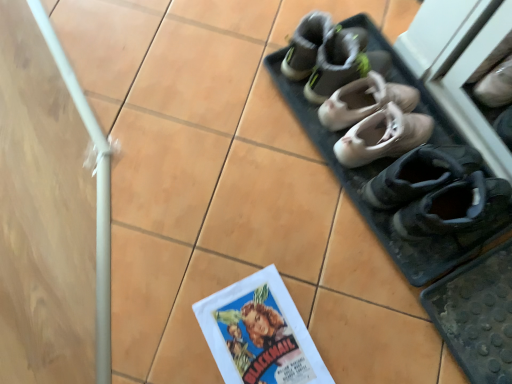
Question: Could you tell me if matte paper comic book at lower center is facing gray suede sneakers at upper center, which is the fifth footwear in bottom-to-top order?

Choices:
 (A) yes
 (B) no

Answer: (B)

Question: From the image's perspective, does matte paper comic book at lower center appear lower than gray suede sneakers at upper center, arranged as the 1th footwear when viewed from the top?

Choices:
 (A) yes
 (B) no

Answer: (A)

Question: Is matte paper comic book at lower center wider than gray suede sneakers at upper center, arranged as the 1th footwear when viewed from the top?

Choices:
 (A) yes
 (B) no

Answer: (A)

Question: Can you confirm if matte paper comic book at lower center is smaller than gray suede sneakers at upper center, arranged as the 1th footwear when viewed from the top?

Choices:
 (A) no
 (B) yes

Answer: (B)

Question: From a real-world perspective, is matte paper comic book at lower center beneath gray suede sneakers at upper center, arranged as the 1th footwear when viewed from the top?

Choices:
 (A) no
 (B) yes

Answer: (B)

Question: Considering the positions of gray suede sneakers at upper center, which is the fifth footwear in bottom-to-top order, and black suede shoes at lower right, positioned as the 1th footwear in bottom-to-top order, in the image, is gray suede sneakers at upper center, which is the fifth footwear in bottom-to-top order, taller or shorter than black suede shoes at lower right, positioned as the 1th footwear in bottom-to-top order,?

Choices:
 (A) short
 (B) tall

Answer: (A)

Question: In terms of size, does gray suede sneakers at upper center, which is the fifth footwear in bottom-to-top order, appear bigger or smaller than black suede shoes at lower right, positioned as the 1th footwear in bottom-to-top order?

Choices:
 (A) big
 (B) small

Answer: (B)

Question: Is gray suede sneakers at upper center, which is the fifth footwear in bottom-to-top order, situated inside black suede shoes at lower right, positioned as the 1th footwear in bottom-to-top order, or outside?

Choices:
 (A) outside
 (B) inside

Answer: (A)

Question: Looking at their shapes, would you say gray suede sneakers at upper center, arranged as the 1th footwear when viewed from the top, is wider or thinner than black suede shoes at lower right, the fifth footwear from the top?

Choices:
 (A) thin
 (B) wide

Answer: (A)

Question: In the image, is gray fabric shoes at upper center positioned in front of or behind light beige leather ballet shoes at center, the 3th footwear viewed from the top?

Choices:
 (A) behind
 (B) front

Answer: (A)

Question: Is gray fabric shoes at upper center inside or outside of light beige leather ballet shoes at center, the 3th footwear viewed from the top?

Choices:
 (A) outside
 (B) inside

Answer: (A)

Question: Looking at the image, does gray fabric shoes at upper center seem bigger or smaller compared to light beige leather ballet shoes at center, the third footwear in the bottom-to-top sequence?

Choices:
 (A) small
 (B) big

Answer: (B)

Question: Considering the positions of gray fabric shoes at upper center and light beige leather ballet shoes at center, the third footwear in the bottom-to-top sequence, in the image, is gray fabric shoes at upper center taller or shorter than light beige leather ballet shoes at center, the third footwear in the bottom-to-top sequence,?

Choices:
 (A) tall
 (B) short

Answer: (A)

Question: Is black suede shoes at lower right, positioned as the 1th footwear in bottom-to-top order, inside the boundaries of light beige leather ballet flats at center, which is counted as the 4th footwear, starting from the bottom, or outside?

Choices:
 (A) inside
 (B) outside

Answer: (B)

Question: From a real-world perspective, relative to light beige leather ballet flats at center, the second footwear from the top, is black suede shoes at lower right, positioned as the 1th footwear in bottom-to-top order, vertically above or below?

Choices:
 (A) below
 (B) above

Answer: (B)